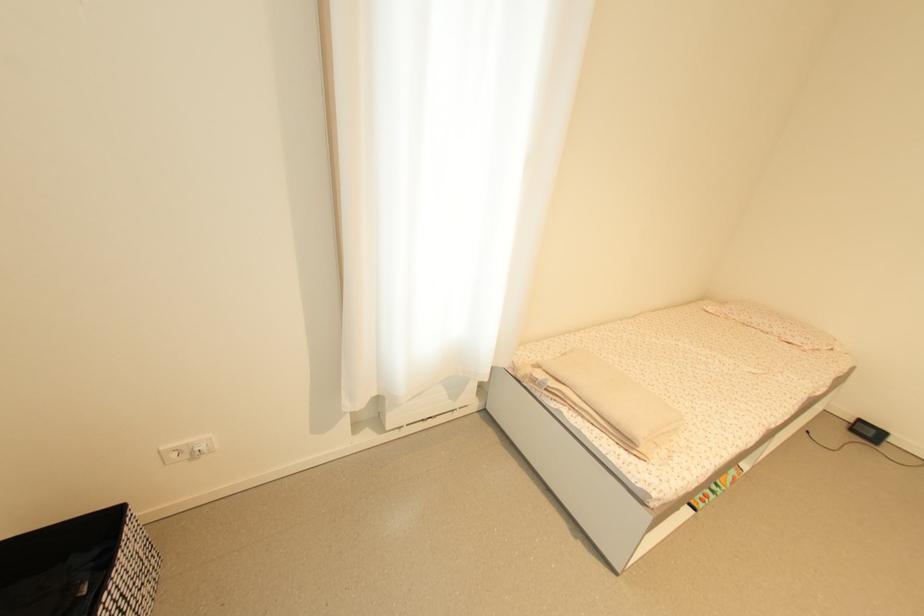
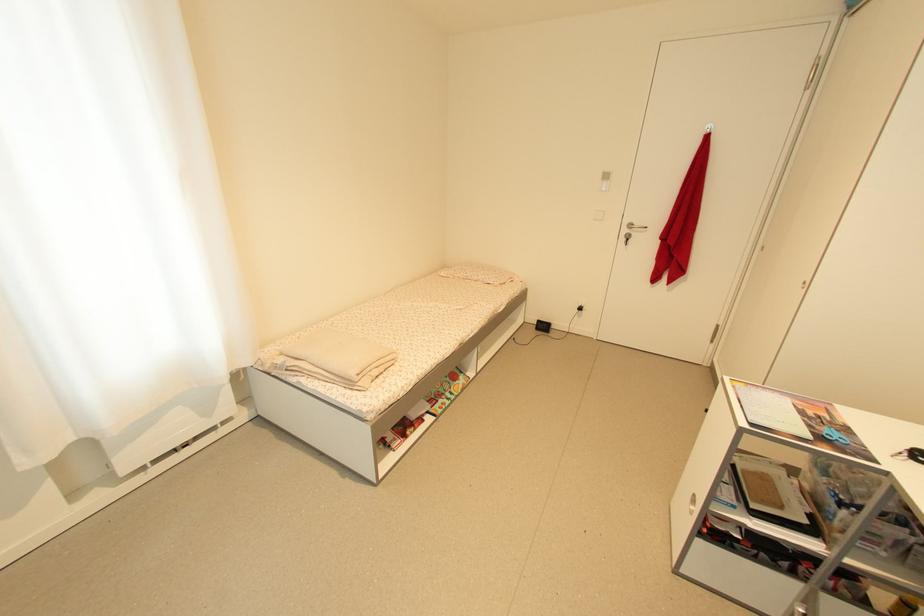
Locate, in the second image, the point that corresponds to (781,334) in the first image.

(485, 282)